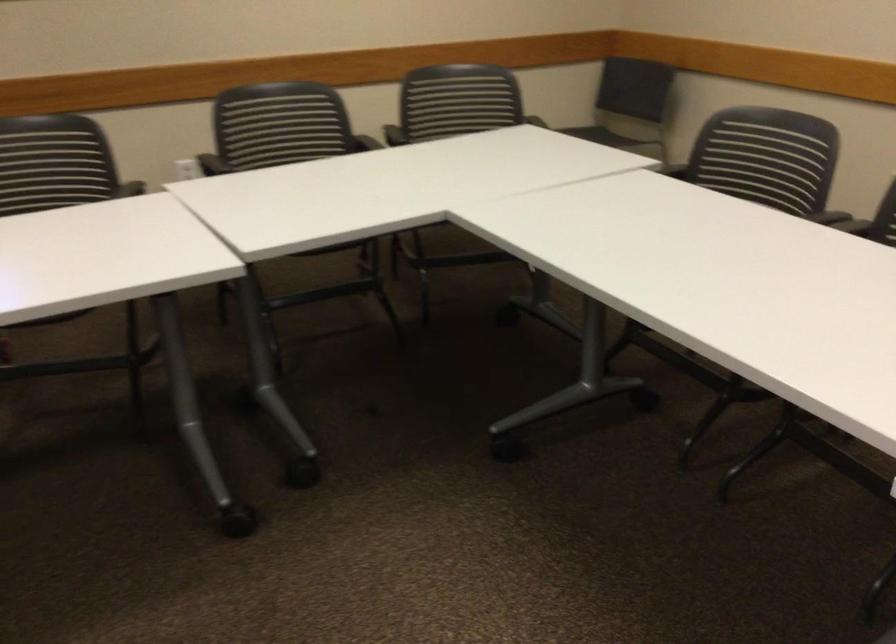
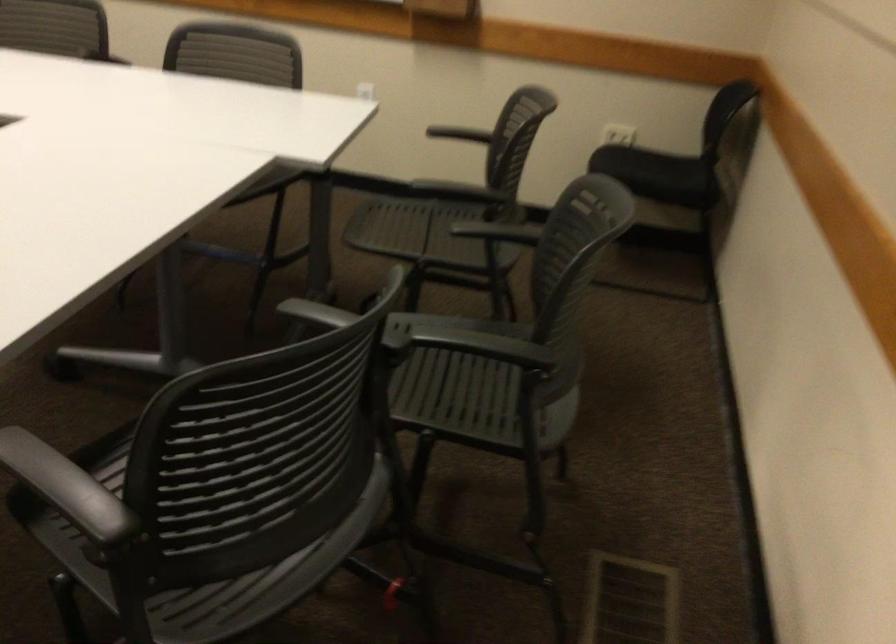
In the second image, find the point that corresponds to [101,169] in the first image.

(141, 440)